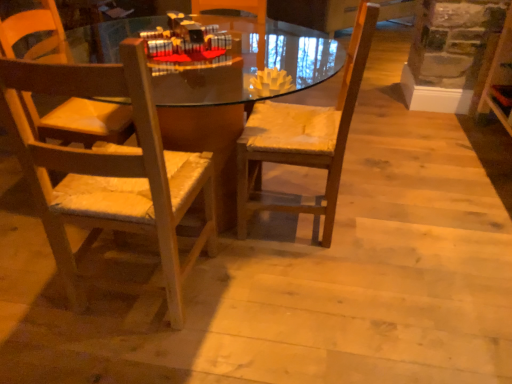
Question: Is point (309, 62) closer or farther from the camera than point (293, 153)?

Choices:
 (A) farther
 (B) closer

Answer: (A)

Question: Is matte wood desk at center wider or thinner than wooden chair at center, the 1th chair from the right?

Choices:
 (A) thin
 (B) wide

Answer: (B)

Question: Which of these objects is positioned farthest from the wooden chair at center, the 1th chair from the right?

Choices:
 (A) wooden chair with woven seat cushion at left, the second chair positioned from the right
 (B) matte wood desk at center

Answer: (B)

Question: Based on their relative distances, which object is farther from the wooden chair with woven seat cushion at left, the second chair positioned from the right?

Choices:
 (A) wooden chair at center, which is the 2th chair from left to right
 (B) matte wood desk at center

Answer: (B)